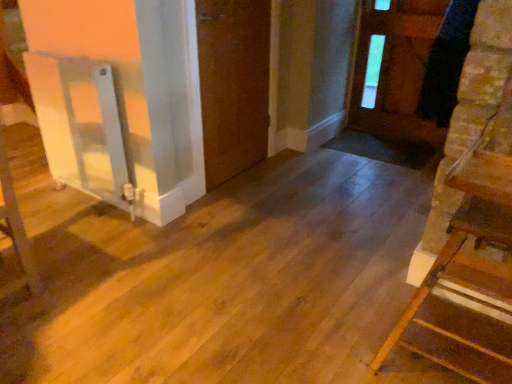
In the scene shown: Measure the distance between wooden staircase at right and camera.

wooden staircase at right is 95.98 centimeters from camera.

This screenshot has height=384, width=512. What do you see at coordinates (397, 70) in the screenshot?
I see `brown wooden door at upper right, marked as the 2th door in a left-to-right arrangement` at bounding box center [397, 70].

Find the location of `brown matte door at center, acting as the 2th door starting from the right`. brown matte door at center, acting as the 2th door starting from the right is located at coordinates tap(233, 84).

What's the angular difference between wooden staircase at right and brown matte door at center, acting as the 2th door starting from the right,'s facing directions?

The angular difference between wooden staircase at right and brown matte door at center, acting as the 2th door starting from the right, is 92.4 degrees.

Does wooden staircase at right have a lesser height compared to brown matte door at center, acting as the 2th door starting from the right?

Correct, wooden staircase at right is not as tall as brown matte door at center, acting as the 2th door starting from the right.

Locate an element on the screen. the 1st door positioned above the wooden staircase at right (from the image's perspective) is located at coordinates (233, 84).

Based on their positions, is wooden staircase at right located to the left or right of brown matte door at center, which is the 1th door from left to right?

In the image, wooden staircase at right appears on the right side of brown matte door at center, which is the 1th door from left to right.

Between brown wooden door at upper right, which appears as the first door when viewed from the right, and wooden staircase at right, which one is positioned behind?

brown wooden door at upper right, which appears as the first door when viewed from the right, is further away from the camera.

From a real-world perspective, which object rests below the other?

wooden staircase at right.

In the scene shown: From the image's perspective, does brown wooden door at upper right, which appears as the first door when viewed from the right, appear lower than wooden staircase at right?

No, from the image's perspective, brown wooden door at upper right, which appears as the first door when viewed from the right, is not below wooden staircase at right.

Consider the image. Which point is more distant from viewer, (409, 63) or (437, 317)?

The point (409, 63) is farther from the camera.

Who is taller, brown wooden door at upper right, which appears as the first door when viewed from the right, or brown matte door at center, acting as the 2th door starting from the right?

Standing taller between the two is brown matte door at center, acting as the 2th door starting from the right.

Which is correct: brown wooden door at upper right, which appears as the first door when viewed from the right, is inside brown matte door at center, acting as the 2th door starting from the right, or outside of it?

brown wooden door at upper right, which appears as the first door when viewed from the right, exists outside the volume of brown matte door at center, acting as the 2th door starting from the right.

How many degrees apart are the facing directions of brown wooden door at upper right, marked as the 2th door in a left-to-right arrangement, and brown matte door at center, acting as the 2th door starting from the right?

The angle between the facing direction of brown wooden door at upper right, marked as the 2th door in a left-to-right arrangement, and the facing direction of brown matte door at center, acting as the 2th door starting from the right, is 89.9 degrees.

Is brown wooden door at upper right, which appears as the first door when viewed from the right, a part of wooden staircase at right?

That's incorrect, brown wooden door at upper right, which appears as the first door when viewed from the right, is not inside wooden staircase at right.

Is wooden staircase at right positioned with its back to brown wooden door at upper right, which appears as the first door when viewed from the right?

No, wooden staircase at right's orientation is not away from brown wooden door at upper right, which appears as the first door when viewed from the right.

Is wooden staircase at right positioned before brown wooden door at upper right, which appears as the first door when viewed from the right?

Yes, wooden staircase at right is closer to the camera.

Does point (208, 136) come farther from viewer compared to point (441, 334)?

Yes, it is.

In the scene shown: Does brown matte door at center, which is the 1th door from left to right, contain wooden staircase at right?

Actually, wooden staircase at right is outside brown matte door at center, which is the 1th door from left to right.

Between brown matte door at center, acting as the 2th door starting from the right, and wooden staircase at right, which one appears on the left side from the viewer's perspective?

brown matte door at center, acting as the 2th door starting from the right.

Considering their positions, is brown matte door at center, acting as the 2th door starting from the right, located in front of or behind brown wooden door at upper right, which appears as the first door when viewed from the right?

In the image, brown matte door at center, acting as the 2th door starting from the right, appears in front of brown wooden door at upper right, which appears as the first door when viewed from the right.

Would you say brown matte door at center, which is the 1th door from left to right, is outside brown wooden door at upper right, marked as the 2th door in a left-to-right arrangement?

Yes, brown matte door at center, which is the 1th door from left to right, is outside of brown wooden door at upper right, marked as the 2th door in a left-to-right arrangement.

Between point (213, 169) and point (407, 5), which one is positioned in front?

The point (213, 169) is more forward.

Who is bigger, brown matte door at center, acting as the 2th door starting from the right, or brown wooden door at upper right, marked as the 2th door in a left-to-right arrangement?

brown matte door at center, acting as the 2th door starting from the right.

Find the location of a particular element. Image resolution: width=512 pixels, height=384 pixels. furniture to the right of brown matte door at center, which is the 1th door from left to right is located at coordinates (466, 280).

I want to click on the 2nd door above the wooden staircase at right (from the image's perspective), so click(397, 70).

From the picture: Looking at the image, which one is located further to brown wooden door at upper right, which appears as the first door when viewed from the right, wooden staircase at right or brown matte door at center, acting as the 2th door starting from the right?

The object further to brown wooden door at upper right, which appears as the first door when viewed from the right, is wooden staircase at right.

From the image, which object appears to be nearer to brown wooden door at upper right, marked as the 2th door in a left-to-right arrangement, brown matte door at center, which is the 1th door from left to right, or wooden staircase at right?

The object closer to brown wooden door at upper right, marked as the 2th door in a left-to-right arrangement, is brown matte door at center, which is the 1th door from left to right.

Considering their positions, is brown wooden door at upper right, which appears as the first door when viewed from the right, positioned further to brown matte door at center, acting as the 2th door starting from the right, than wooden staircase at right?

wooden staircase at right is positioned further to the anchor brown matte door at center, acting as the 2th door starting from the right.

From the image, which object appears to be nearer to wooden staircase at right, brown wooden door at upper right, which appears as the first door when viewed from the right, or brown matte door at center, acting as the 2th door starting from the right?

brown matte door at center, acting as the 2th door starting from the right, is closer to wooden staircase at right.

Based on their spatial positions, is brown matte door at center, acting as the 2th door starting from the right, or brown wooden door at upper right, marked as the 2th door in a left-to-right arrangement, further from wooden staircase at right?

Among the two, brown wooden door at upper right, marked as the 2th door in a left-to-right arrangement, is located further to wooden staircase at right.

From the image, which object appears to be nearer to brown matte door at center, which is the 1th door from left to right, wooden staircase at right or brown wooden door at upper right, which appears as the first door when viewed from the right?

brown wooden door at upper right, which appears as the first door when viewed from the right.

You are a GUI agent. You are given a task and a screenshot of the screen. Output one action in this format:
    pyautogui.click(x=<x>, y=<y>)
    Task: Click on the door positioned between wooden staircase at right and brown wooden door at upper right, marked as the 2th door in a left-to-right arrangement, from near to far
    This screenshot has width=512, height=384.
    Given the screenshot: What is the action you would take?
    pyautogui.click(x=233, y=84)